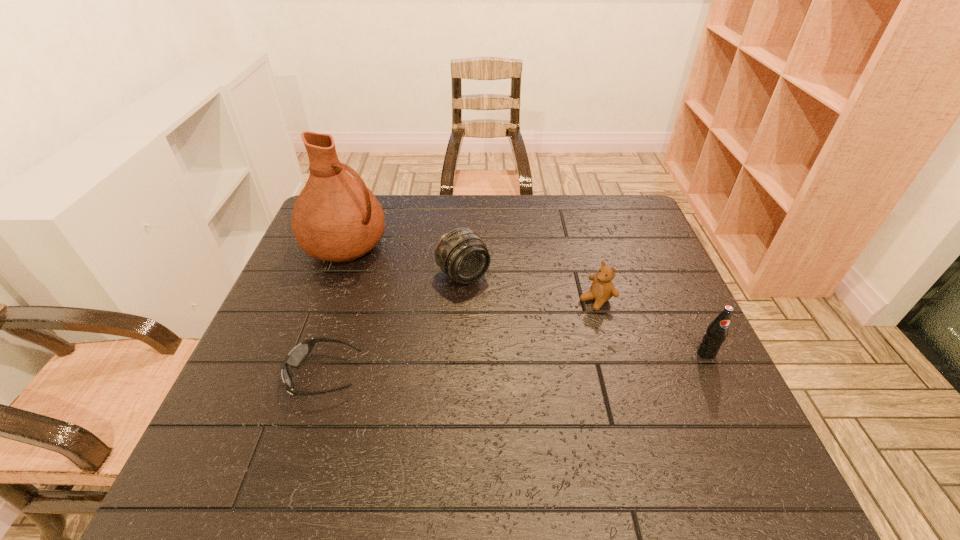
You are a GUI agent. You are given a task and a screenshot of the screen. Output one action in this format:
    pyautogui.click(x=<x>, y=<y>)
    Task: Click on the sunglasses
    Image resolution: width=960 pixels, height=540 pixels.
    Given the screenshot: What is the action you would take?
    pyautogui.click(x=298, y=354)

This screenshot has height=540, width=960. What are the coordinates of `pop` in the screenshot? It's located at (716, 332).

Where is `telephoto lens`? Image resolution: width=960 pixels, height=540 pixels. telephoto lens is located at coordinates coord(461,254).

Where is `the tallest object`? the tallest object is located at coordinates (336, 218).

I want to click on the second object from right to left, so click(602, 289).

The width and height of the screenshot is (960, 540). Find the location of `the fourth tallest object`. the fourth tallest object is located at coordinates (602, 289).

This screenshot has width=960, height=540. Find the location of `vacant space located 0.120m on the front label of the rightmost object`. vacant space located 0.120m on the front label of the rightmost object is located at coordinates (732, 408).

In order to click on vacant position located at the front element of the third object from left to right in this screenshot , I will do `click(530, 349)`.

Where is `vacant area situated 0.170m at the front element of the third object from left to right`? vacant area situated 0.170m at the front element of the third object from left to right is located at coordinates (x=515, y=332).

The image size is (960, 540). Identify the location of vacant area situated at the front element of the third object from left to right. (533, 352).